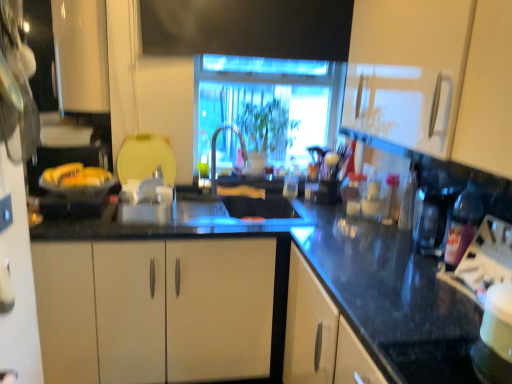
Question: Considering the positions of point (65, 49) and point (220, 72), is point (65, 49) closer or farther from the camera than point (220, 72)?

Choices:
 (A) farther
 (B) closer

Answer: (B)

Question: Is white glossy cabinet at upper left, acting as the 2th cabinetry starting from the front, taller or shorter than transparent glass window at center?

Choices:
 (A) tall
 (B) short

Answer: (A)

Question: Which object is the closest to the satin nickel faucet at center?

Choices:
 (A) white glossy cabinet at upper left, marked as the 2th cabinetry in a right-to-left arrangement
 (B) translucent plastic bottle at center, which appears as the second bottle when viewed from the right
 (C) transparent glass window at center
 (D) white matte cabinet at upper right, the 2th cabinetry in the left-to-right sequence
 (E) translucent purple bottle at right, the 2th bottle from the left

Answer: (C)

Question: Estimate the real-world distances between objects in this image. Which object is farther from the translucent purple bottle at right, which is the first bottle from right to left?

Choices:
 (A) satin nickel faucet at center
 (B) transparent glass window at center
 (C) white matte cabinet at upper right, placed as the first cabinetry when sorted from front to back
 (D) translucent plastic bottle at center, which ranks as the second bottle in bottom-to-top order
 (E) white glossy cabinet at upper left, acting as the 1th cabinetry starting from the back

Answer: (E)